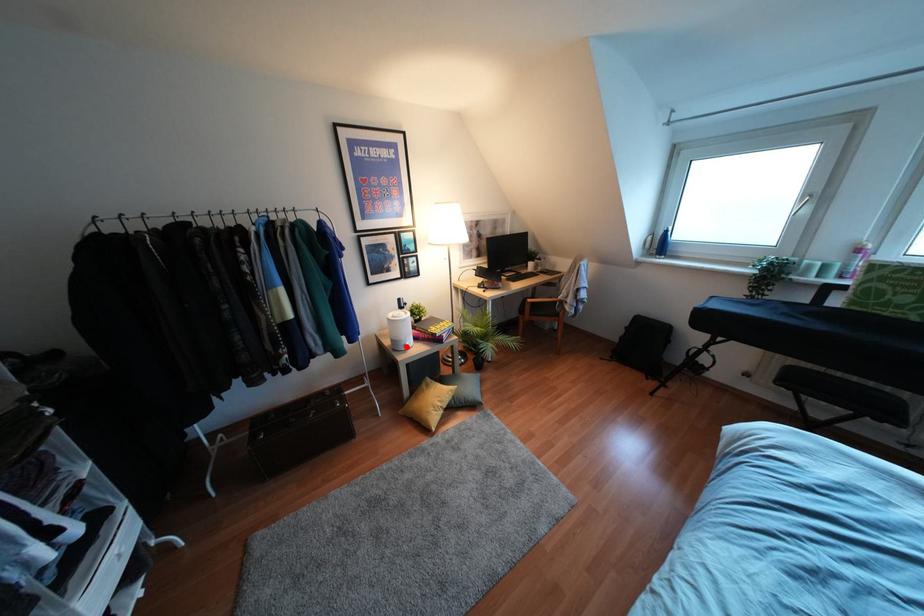
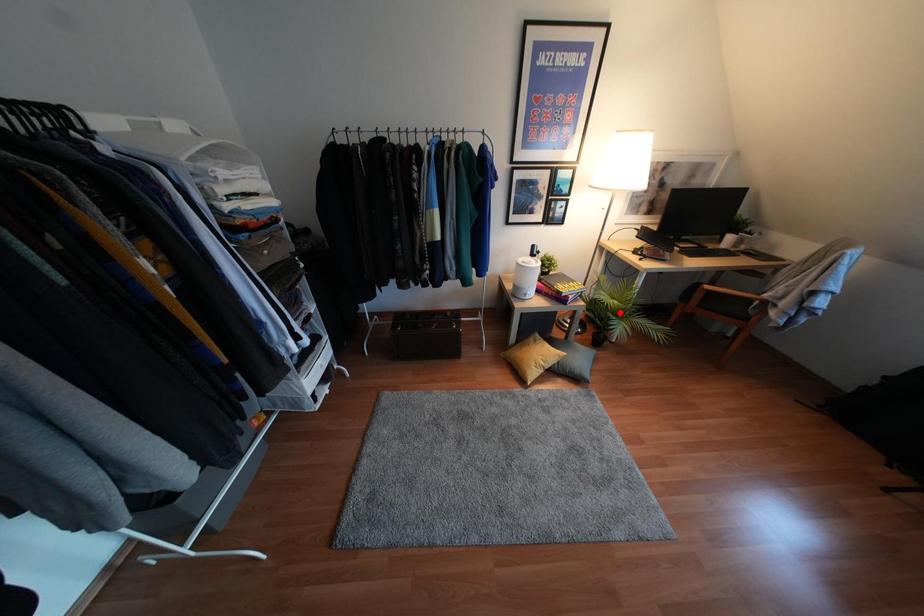
I am providing you with two images of the same scene from different viewpoints. A red point is marked on the first image and another point is marked on the second image. Is the red point in image1 aligned with the point shown in image2?

No